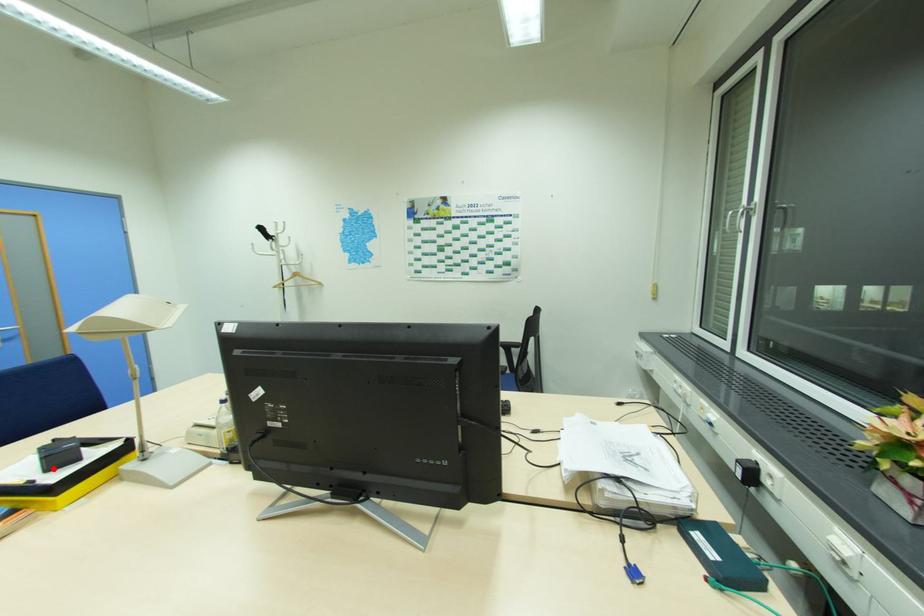
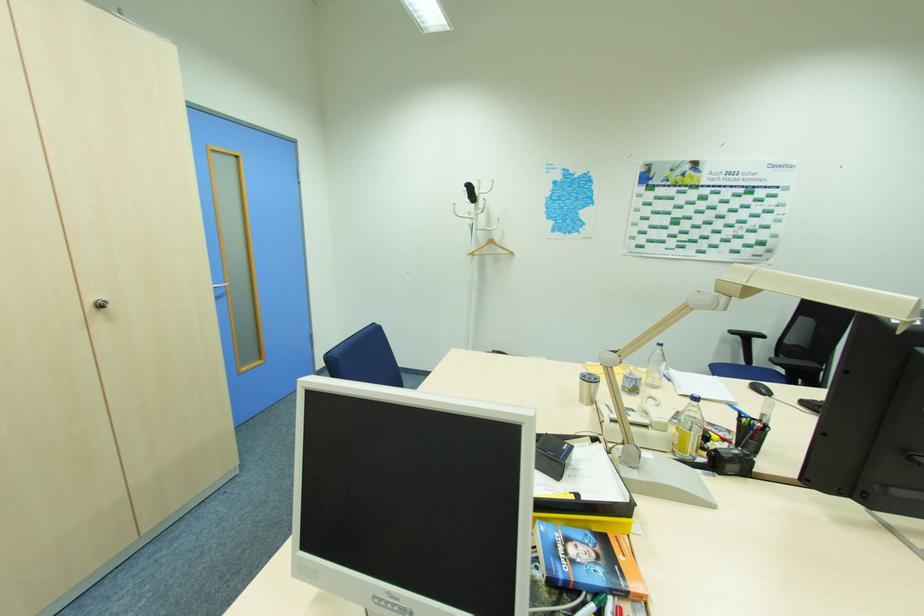
Where in the second image is the point corresponding to the highlighted location from the first image?

(561, 476)